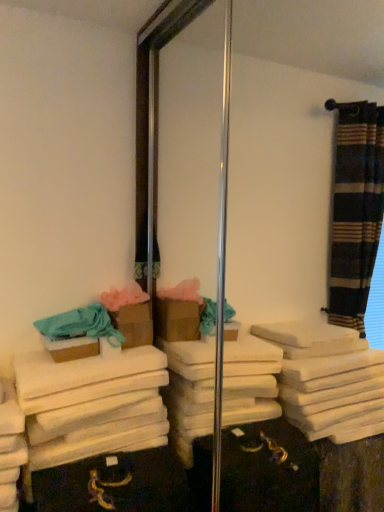
Question: From a real-world perspective, is white soft towel at lower left, the 2th bath towel from the top, above or below teal cotton bath towel at left, marked as the second bath towel in a bottom-to-top arrangement?

Choices:
 (A) above
 (B) below

Answer: (B)

Question: In terms of width, does white soft towel at lower left, marked as the first bath towel in a bottom-to-top arrangement, look wider or thinner when compared to teal cotton bath towel at left, which is the first bath towel from top to bottom?

Choices:
 (A) thin
 (B) wide

Answer: (B)

Question: Which object is the closest to the brown cardboard box at center, the 1th box from the front?

Choices:
 (A) white soft towel at lower left, the 2th bath towel from the top
 (B) brown cardboard box at left, which is the 2th box in front-to-back order
 (C) teal cotton bath towel at left, marked as the second bath towel in a bottom-to-top arrangement

Answer: (C)

Question: Which object is positioned closest to the brown cardboard box at left, marked as the 1th box in a back-to-front arrangement?

Choices:
 (A) brown cardboard box at center, the 1th box from the front
 (B) white soft towel at lower left, marked as the first bath towel in a bottom-to-top arrangement
 (C) teal cotton bath towel at left, which is the first bath towel from top to bottom

Answer: (C)